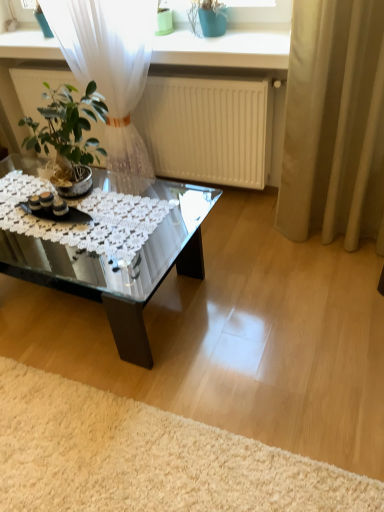
Identify the location of vacant area on top of transparent glass coffee table at center (from a real-world perspective). Image resolution: width=384 pixels, height=512 pixels. (74, 213).